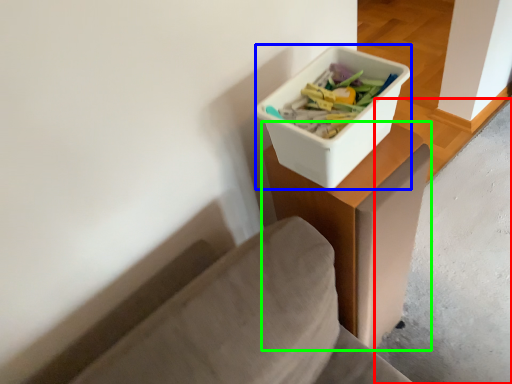
Question: Which object is positioned farthest from concrete (highlighted by a red box)? Select from storage box (highlighted by a blue box) and table (highlighted by a green box).

Choices:
 (A) storage box
 (B) table

Answer: (A)